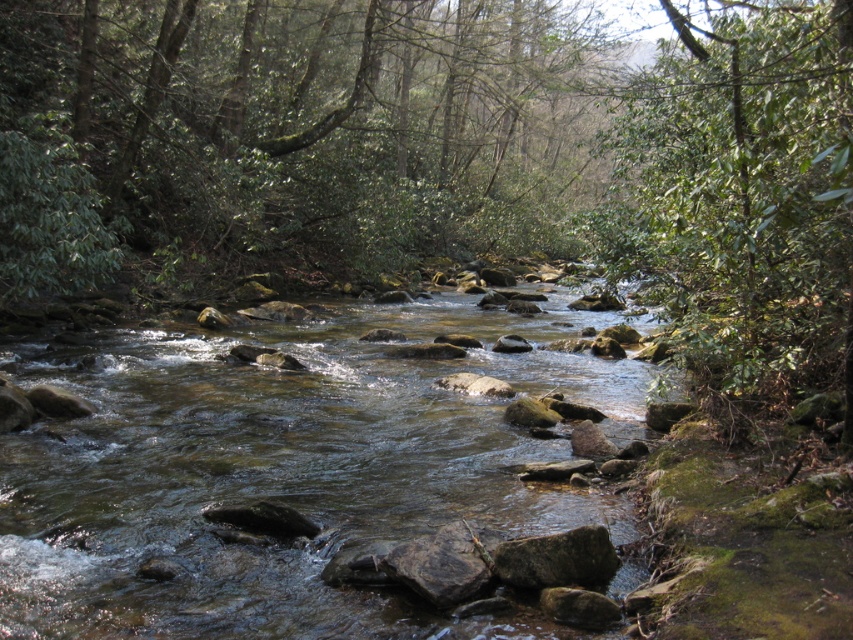
Between clear water at center and green leafy tree at upper right, which one is positioned higher?

Positioned higher is green leafy tree at upper right.

Is clear water at center shorter than green leafy tree at upper right?

Indeed, clear water at center has a lesser height compared to green leafy tree at upper right.

This screenshot has width=853, height=640. In order to click on clear water at center in this screenshot , I will do `click(285, 472)`.

Is green leafy tree at upper center taller than green leafy tree at upper right?

Yes.

Between point (303, 202) and point (805, 88), which one is positioned in front?

Point (805, 88) is in front.

Locate an element on the screen. Image resolution: width=853 pixels, height=640 pixels. green leafy tree at upper center is located at coordinates (287, 134).

The image size is (853, 640). In order to click on green leafy tree at upper center in this screenshot , I will do `click(287, 134)`.

Is the position of green leafy tree at upper center less distant than that of clear water at center?

No, green leafy tree at upper center is further to the viewer.

This screenshot has height=640, width=853. I want to click on green leafy tree at upper center, so click(287, 134).

Where is `green leafy tree at upper center`? green leafy tree at upper center is located at coordinates (287, 134).